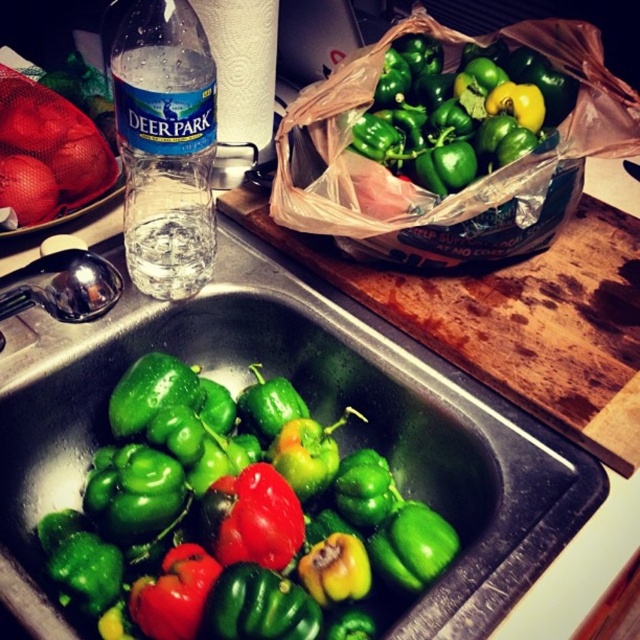
Can you confirm if green matte peppers at lower left is positioned to the left of green matte bell pepper at upper center?

Indeed, green matte peppers at lower left is positioned on the left side of green matte bell pepper at upper center.

Is green matte peppers at lower left closer to the viewer compared to green matte bell pepper at upper center?

Yes, green matte peppers at lower left is closer to the viewer.

What do you see at coordinates (312, 413) in the screenshot? I see `green matte peppers at lower left` at bounding box center [312, 413].

This screenshot has height=640, width=640. In order to click on green matte peppers at lower left in this screenshot , I will do `click(312, 413)`.

Locate an element on the screen. This screenshot has width=640, height=640. green matte peppers at lower left is located at coordinates (312, 413).

Is green matte peppers at lower left to the left of green matte bell pepper at sink from the viewer's perspective?

No, green matte peppers at lower left is not to the left of green matte bell pepper at sink.

What are the coordinates of `green matte peppers at lower left` in the screenshot? It's located at (312, 413).

Looking at this image, does transparent plastic water bottle at left come in front of green matte bell pepper at upper center?

Yes, it is.

Does transparent plastic water bottle at left appear under green matte bell pepper at upper center?

No.

Locate an element on the screen. The height and width of the screenshot is (640, 640). transparent plastic water bottle at left is located at coordinates (164, 145).